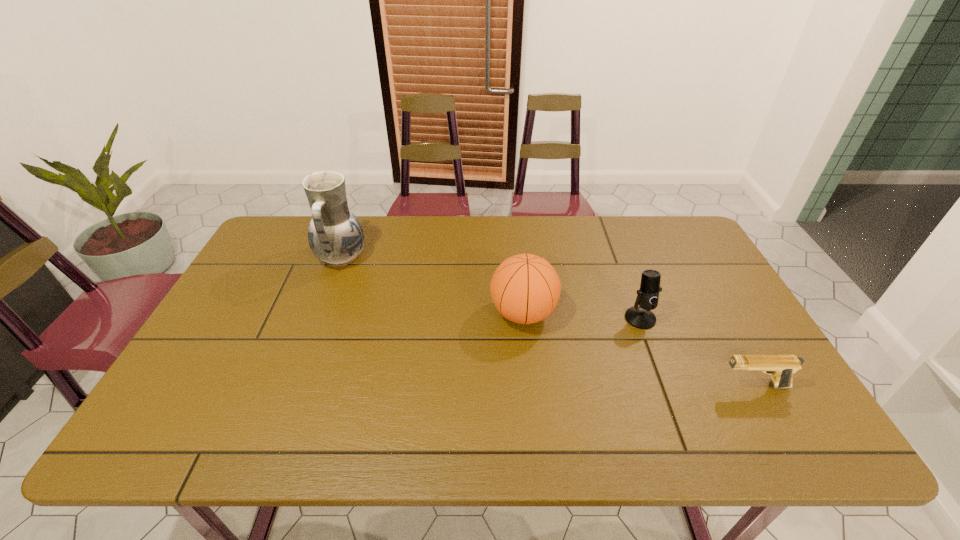
Identify the location of vacant area situated on the stand of the third tallest object. (681, 424).

Where is `vacant space located 0.090m at the barrel of the rightmost object`? vacant space located 0.090m at the barrel of the rightmost object is located at coordinates (680, 386).

Identify the location of vacant area situated 0.400m at the barrel of the rightmost object. This screenshot has height=540, width=960. (549, 386).

Image resolution: width=960 pixels, height=540 pixels. In order to click on blank area located at the barrel of the rightmost object in this screenshot , I will do `click(634, 386)`.

You are a GUI agent. You are given a task and a screenshot of the screen. Output one action in this format:
    pyautogui.click(x=<x>, y=<y>)
    Task: Click on the object at the far edge
    
    Given the screenshot: What is the action you would take?
    click(335, 235)

Where is `object that is at the right edge`? The image size is (960, 540). object that is at the right edge is located at coordinates (781, 368).

Identify the location of vacant space at the far edge of the desktop. click(611, 234).

At what (x,y) coordinates should I click in order to perform the action: click on vacant space at the near edge of the desktop. Please return your answer as a coordinate pair (x, y). Image resolution: width=960 pixels, height=540 pixels. Looking at the image, I should click on (674, 447).

In order to click on vacant space at the left edge of the desktop in this screenshot , I will do `click(256, 268)`.

In the image, there is a desktop. Where is `vacant space at the right edge`? The image size is (960, 540). vacant space at the right edge is located at coordinates click(731, 312).